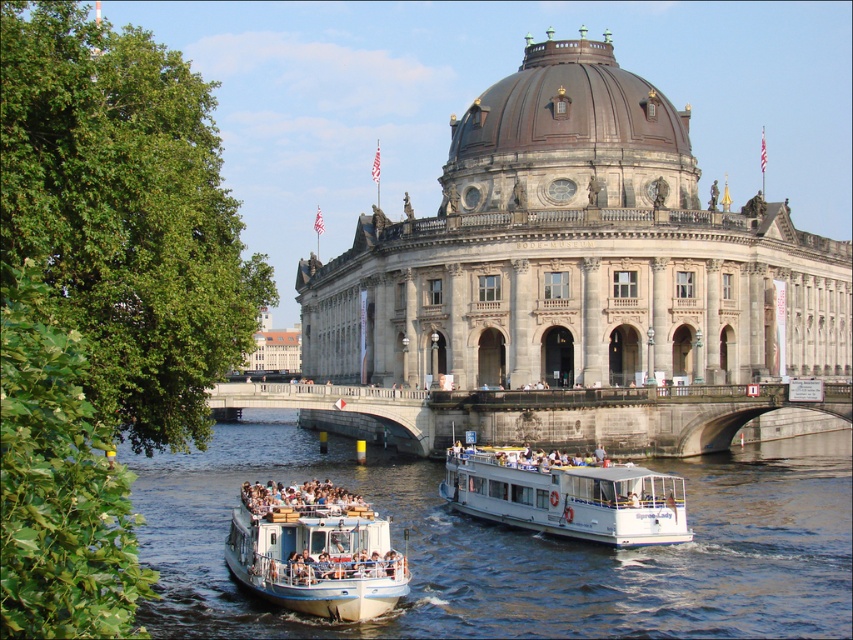
Is white matte boat at lower left wider than white matte boat at center?

In fact, white matte boat at lower left might be narrower than white matte boat at center.

Is point (393, 563) positioned behind point (467, 484)?

No, (393, 563) is closer to viewer.

Does point (357, 515) lie in front of point (672, 499)?

Yes, it is.

The image size is (853, 640). In order to click on white matte boat at lower left in this screenshot , I will do `click(314, 550)`.

Can you confirm if gray stone building at center is shorter than blue water at lower center?

In fact, gray stone building at center may be taller than blue water at lower center.

Who is more distant from viewer, (659, 188) or (646, 568)?

Point (659, 188)

This screenshot has width=853, height=640. I want to click on gray stone building at center, so [575, 253].

Is gray stone building at center shorter than white matte boat at center?

No, gray stone building at center is not shorter than white matte boat at center.

Which of these two, gray stone building at center or white matte boat at center, stands taller?

With more height is gray stone building at center.

Between point (747, 333) and point (618, 509), which one is positioned in front?

Point (618, 509)

This screenshot has height=640, width=853. Find the location of `gray stone building at center`. gray stone building at center is located at coordinates (575, 253).